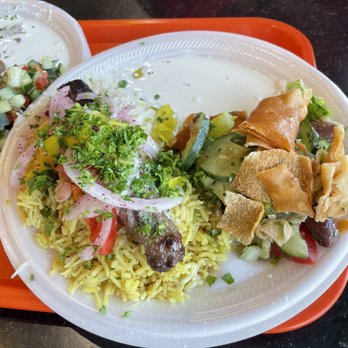
This screenshot has height=348, width=348. In order to click on paper plates in this screenshot , I will do `click(190, 77)`, `click(47, 35)`.